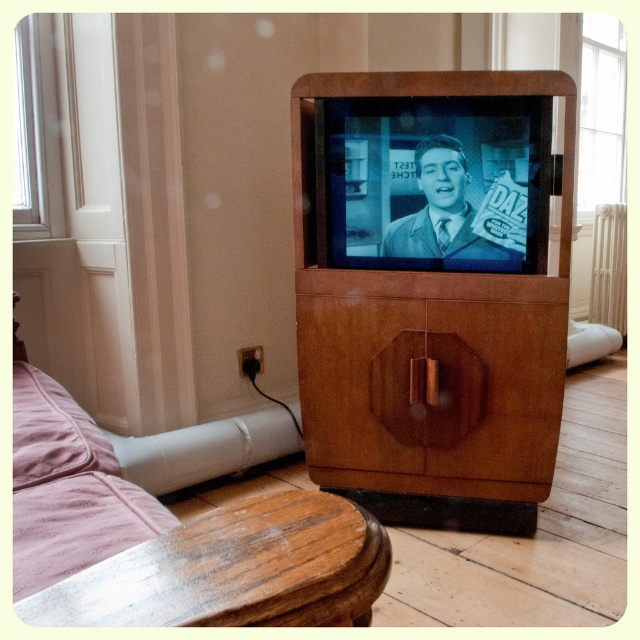
You are arranging a new lamp in the vintage living room. You have a tall floor lamp that needs to be placed either on the wooden cabinet at center or the wooden side table at lower left. Based on their positions, which surface can the lamp be placed on without it being obstructed by the other object?

The wooden cabinet at center is positioned over the wooden side table at lower left, so placing the lamp on the wooden side table at lower left would be obstructed by the cabinet. The lamp should be placed on the wooden cabinet at center instead.

You are a furniture designer assessing the dimensions of the wooden cabinet at center and the wooden side table at lower left in the vintage living room. Which object is taller?

The wooden cabinet at center is taller than the wooden side table at lower left.